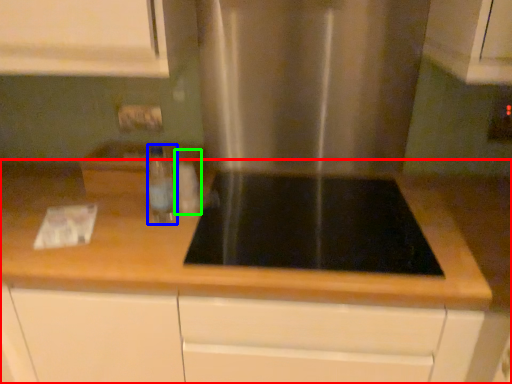
Question: Which object is positioned farthest from countertop (highlighted by a red box)? Select from bottle (highlighted by a blue box) and bottle (highlighted by a green box).

Choices:
 (A) bottle
 (B) bottle

Answer: (B)